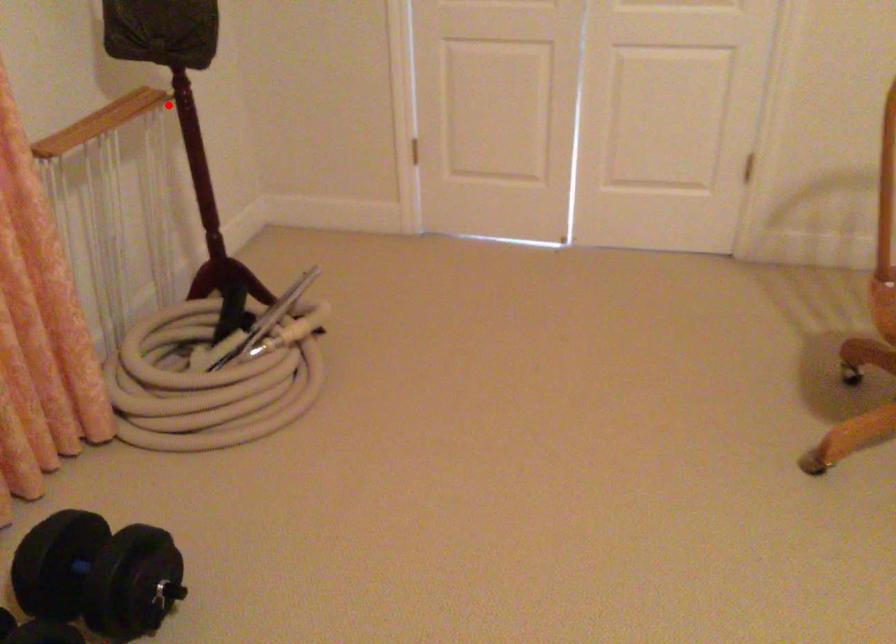
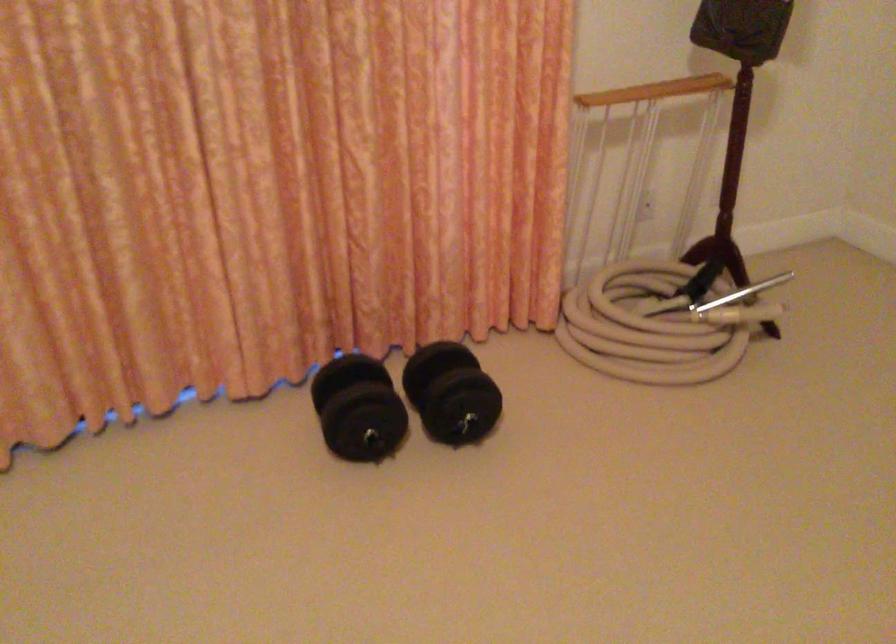
Question: I am providing you with two images of the same scene from different viewpoints. Image1 has a red point marked. In image2, the corresponding 3D location appears at what relative position? Reply with the corresponding letter.

Choices:
 (A) Closer
 (B) Farther

Answer: (B)